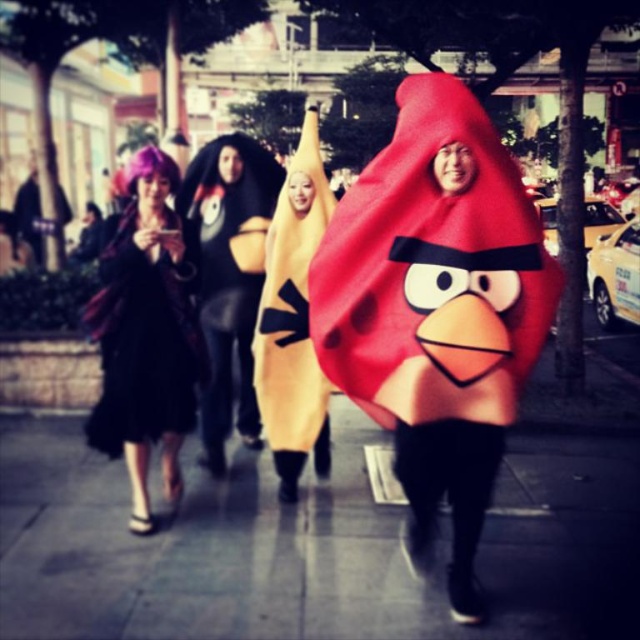
Question: Can you confirm if smooth concrete pavement at center is smaller than purple fabric dress at left?

Choices:
 (A) yes
 (B) no

Answer: (B)

Question: Which object appears closest to the camera in this image?

Choices:
 (A) matte red costume at center
 (B) purple fabric dress at left
 (C) smooth concrete pavement at center

Answer: (A)

Question: Which object appears farthest from the camera in this image?

Choices:
 (A) matte red costume at center
 (B) smooth concrete pavement at center
 (C) purple fabric dress at left

Answer: (C)

Question: Which of the following is the farthest from the observer?

Choices:
 (A) (120, 252)
 (B) (548, 266)
 (C) (97, 532)

Answer: (C)

Question: Does smooth concrete pavement at center lie behind matte red costume at center?

Choices:
 (A) no
 (B) yes

Answer: (B)

Question: Is matte red costume at center below purple fabric dress at left?

Choices:
 (A) no
 (B) yes

Answer: (B)